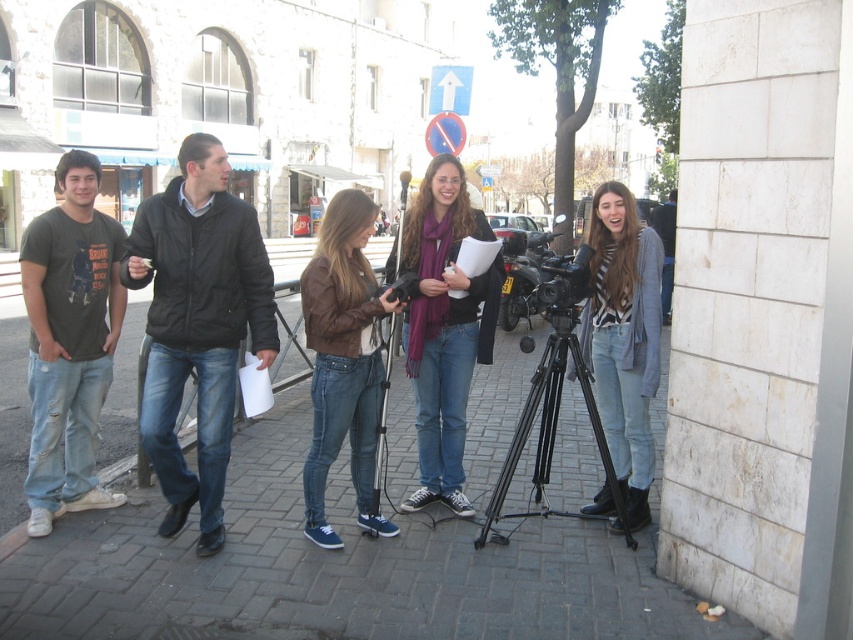
You are a photographer standing at the edge of the sidewalk. You notice a point marked at coordinates (624,339). Can you tell me what object this point is located on?

The point (624,339) is located on the striped knit sweater at center.

You are standing at point (335, 570) in the image. What material are you standing on?

You are standing on brick pavement at center.